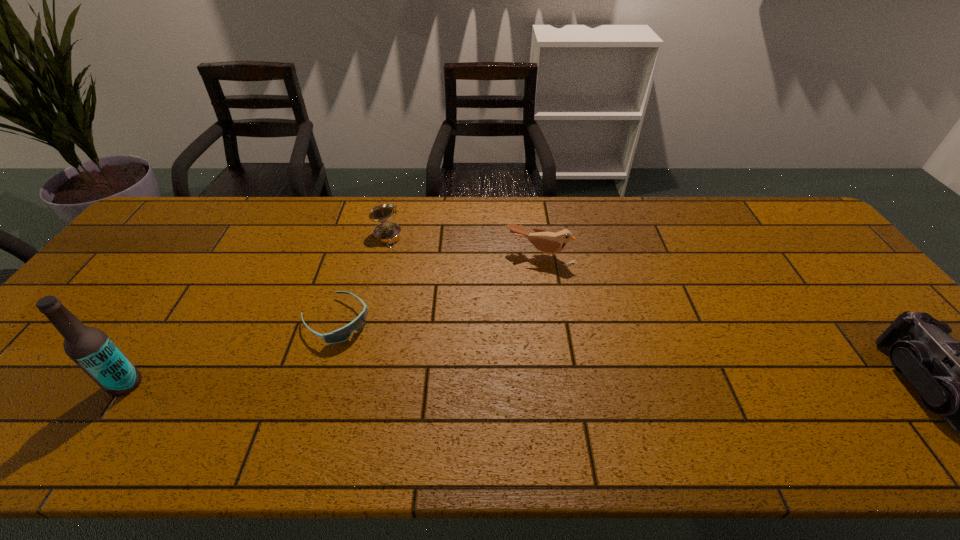
Find the location of a particular element. The width and height of the screenshot is (960, 540). blank space located 0.150m on the front-facing side of the shortest object is located at coordinates (394, 372).

You are a GUI agent. You are given a task and a screenshot of the screen. Output one action in this format:
    pyautogui.click(x=<x>, y=<y>)
    Task: Click on the vacant region located 0.180m with the dial facing the compass
    The height and width of the screenshot is (540, 960).
    Given the screenshot: What is the action you would take?
    pyautogui.click(x=402, y=286)

Locate an element on the screen. This screenshot has width=960, height=540. vacant space situated 0.070m with the dial facing the compass is located at coordinates (394, 261).

You are a GUI agent. You are given a task and a screenshot of the screen. Output one action in this format:
    pyautogui.click(x=<x>, y=<y>)
    Task: Click on the vacant space situated 0.250m with the dial facing the compass
    The image size is (960, 540).
    Given the screenshot: What is the action you would take?
    pyautogui.click(x=408, y=303)

You are a GUI agent. You are given a task and a screenshot of the screen. Output one action in this format:
    pyautogui.click(x=<x>, y=<y>)
    Task: Click on the object that is at the far edge
    
    Given the screenshot: What is the action you would take?
    pyautogui.click(x=385, y=233)

The width and height of the screenshot is (960, 540). Find the location of `object located at the near edge`. object located at the near edge is located at coordinates (91, 349).

The width and height of the screenshot is (960, 540). In order to click on vacant region at the far edge of the desktop in this screenshot , I will do `click(481, 205)`.

In the image, there is a desktop. At what (x,y) coordinates should I click in order to perform the action: click on free region at the near edge. Please return your answer as a coordinate pair (x, y). Looking at the image, I should click on (725, 385).

This screenshot has height=540, width=960. Identify the location of vacant space at the left edge of the desktop. [135, 248].

Find the location of a particular element. This screenshot has height=540, width=960. free spot at the far left corner of the desktop is located at coordinates (175, 225).